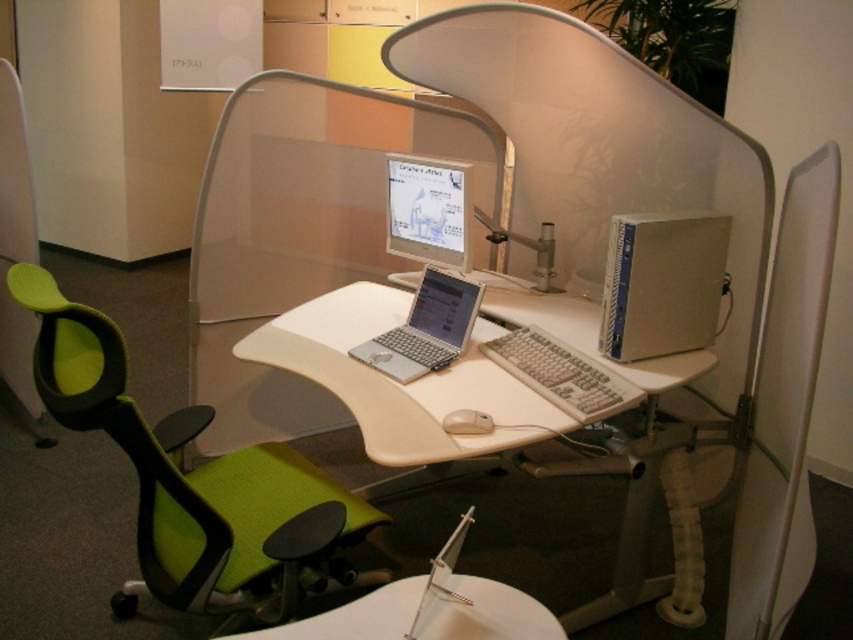
Question: Is white plastic desk at center above matte silver monitor at center?

Choices:
 (A) no
 (B) yes

Answer: (A)

Question: Is green mesh swivel chair at left above silver metallic laptop at center?

Choices:
 (A) no
 (B) yes

Answer: (A)

Question: Which object is closer to the camera taking this photo?

Choices:
 (A) silver metallic laptop at center
 (B) satin silver computer tower at right

Answer: (B)

Question: Can you confirm if green mesh swivel chair at left is bigger than satin silver computer tower at right?

Choices:
 (A) yes
 (B) no

Answer: (A)

Question: Which of the following is the closest to the observer?

Choices:
 (A) (447, 289)
 (B) (129, 612)

Answer: (B)

Question: Which point is closer to the camera?

Choices:
 (A) satin silver computer tower at right
 (B) green mesh swivel chair at left
 (C) matte silver monitor at center
 (D) silver metallic laptop at center

Answer: (B)